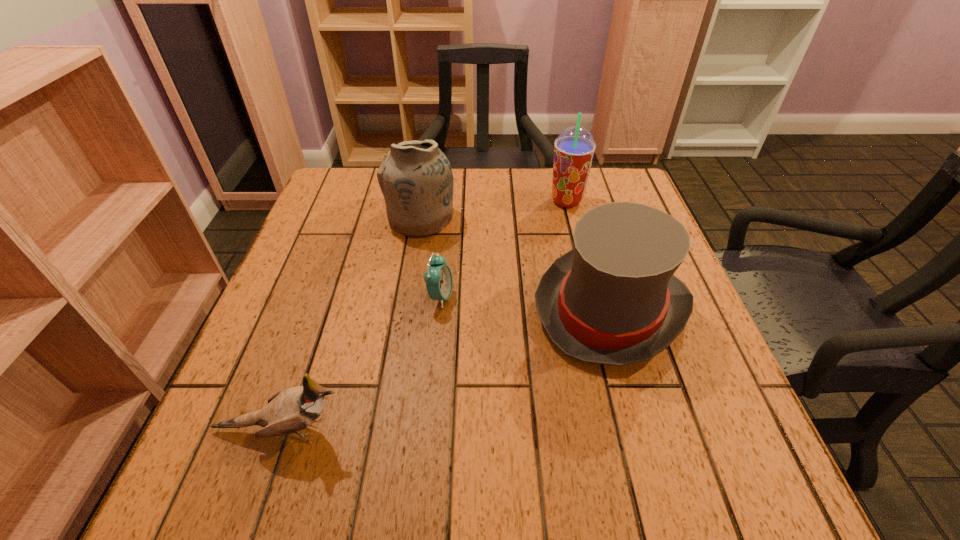
Where is `free region located 0.060m on the face of the alarm clock`? The image size is (960, 540). free region located 0.060m on the face of the alarm clock is located at coordinates (482, 297).

Locate an element on the screen. This screenshot has height=540, width=960. smoothie that is at the far edge is located at coordinates (574, 149).

Locate an element on the screen. pottery that is at the far edge is located at coordinates click(x=416, y=179).

Find the location of a particular element. object that is positioned at the near edge is located at coordinates (290, 410).

Find the location of `object that is positioned at the left edge`. object that is positioned at the left edge is located at coordinates [x=290, y=410].

Locate an element on the screen. smoothie at the right edge is located at coordinates (574, 149).

Find the location of a particular element. This screenshot has height=540, width=960. dress hat that is positioned at the right edge is located at coordinates (613, 299).

The image size is (960, 540). Identify the location of object that is at the near left corner. (290, 410).

Locate an element on the screen. Image resolution: width=960 pixels, height=540 pixels. object situated at the far right corner is located at coordinates (574, 149).

You are a GUI agent. You are given a task and a screenshot of the screen. Output one action in this format:
    pyautogui.click(x=<x>, y=<y>)
    Task: Click on the vacant area at the far edge of the desktop
    The image size is (960, 540).
    Given the screenshot: What is the action you would take?
    520,212